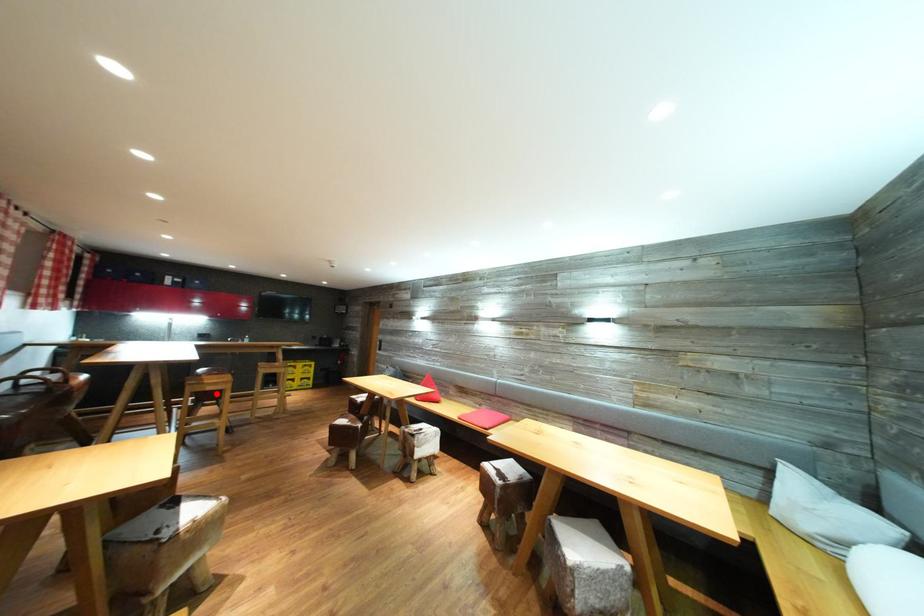
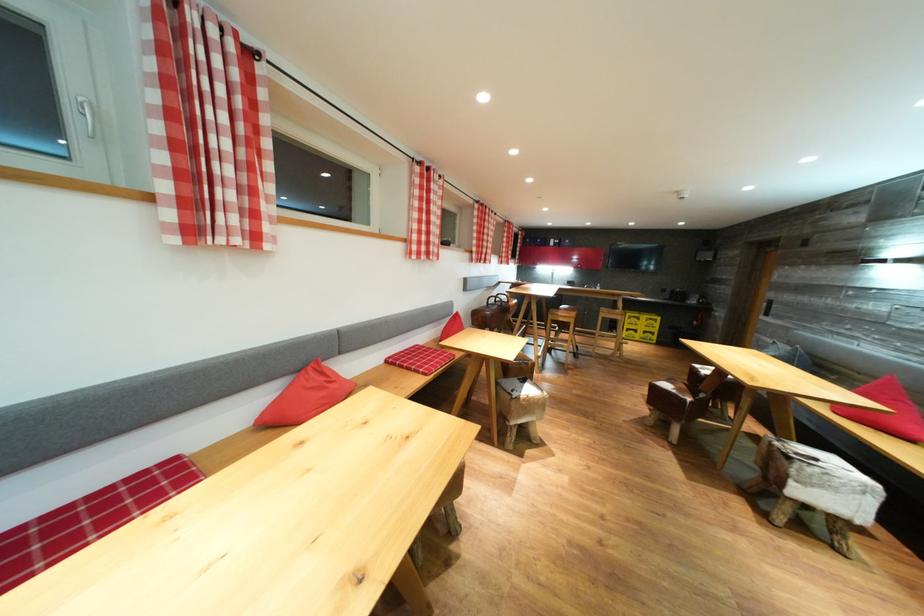
Question: I am providing you with two images of the same scene from different viewpoints. A red point is marked on the first image. Can you still see the location of the red point in image 2?

Choices:
 (A) Yes
 (B) No

Answer: (A)